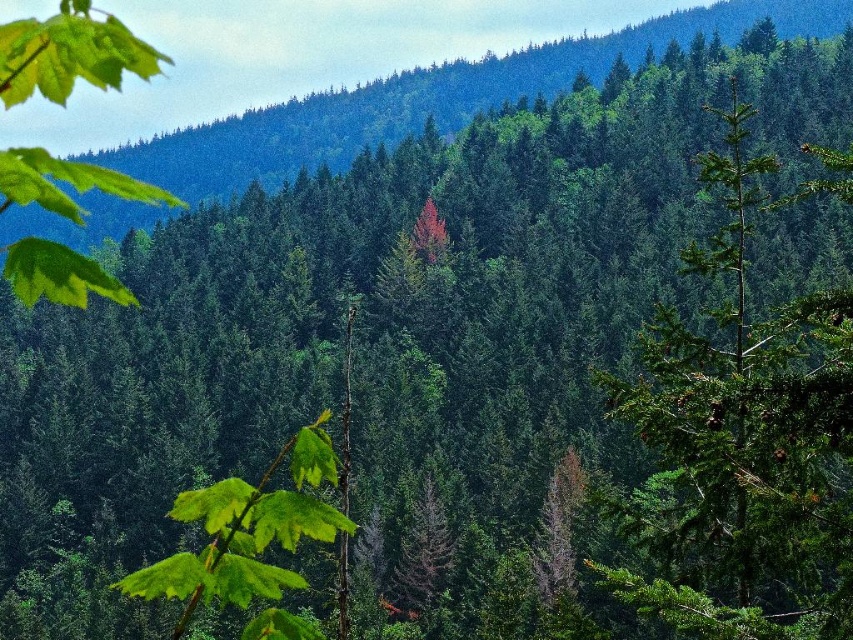
Can you confirm if green matte forest at center is smaller than green matte leaf at upper left?

Indeed, green matte forest at center has a smaller size compared to green matte leaf at upper left.

Based on the photo, measure the distance between green matte forest at center and green matte leaf at upper left.

They are 306.83 feet apart.

This screenshot has width=853, height=640. I want to click on green matte forest at center, so click(428, 100).

The width and height of the screenshot is (853, 640). Describe the element at coordinates (746, 438) in the screenshot. I see `green needle-like tree at right` at that location.

Is green needle-like tree at right positioned in front of green matte forest at center?

Yes, green needle-like tree at right is closer to the viewer.

Describe the element at coordinates (746, 438) in the screenshot. I see `green needle-like tree at right` at that location.

Find the location of a particular element. green needle-like tree at right is located at coordinates (746, 438).

Does point (682, 493) lie behind point (41, 278)?

That is True.

Can you confirm if green needle-like tree at right is taller than green matte leaf at upper left?

No, green needle-like tree at right is not taller than green matte leaf at upper left.

What are the coordinates of `green needle-like tree at right` in the screenshot? It's located at (746, 438).